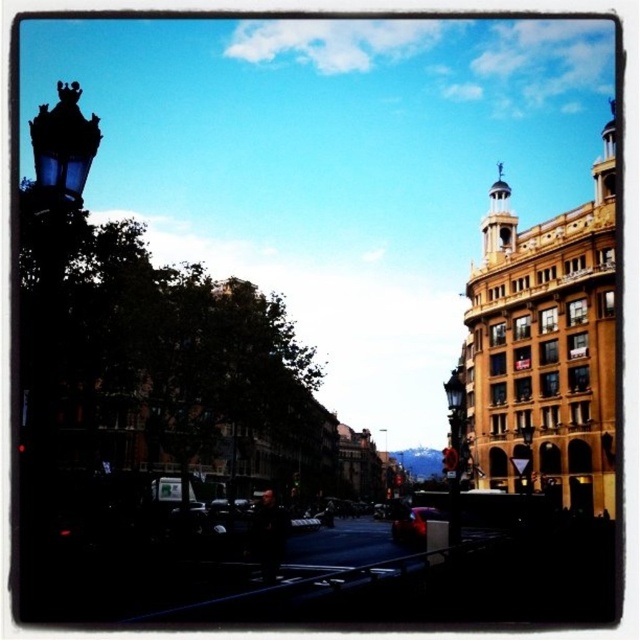
Question: Is glossy red car at center below black glass street light at center?

Choices:
 (A) no
 (B) yes

Answer: (B)

Question: Among these points, which one is nearest to the camera?

Choices:
 (A) (454, 417)
 (B) (529, 492)
 (C) (384, 440)

Answer: (A)

Question: Does matte black street light at center have a larger size compared to glossy red car at center?

Choices:
 (A) yes
 (B) no

Answer: (A)

Question: Which of the following is the closest to the observer?

Choices:
 (A) black glass street light at center
 (B) metallic street light at center
 (C) glossy red car at center
 (D) matte black street light at center

Answer: (D)

Question: In this image, where is matte black street light at center located relative to glossy red car at center?

Choices:
 (A) below
 (B) above

Answer: (B)

Question: Which object is farther from the camera taking this photo?

Choices:
 (A) matte black street light at center
 (B) metallic street light at center
 (C) glossy red car at center

Answer: (B)